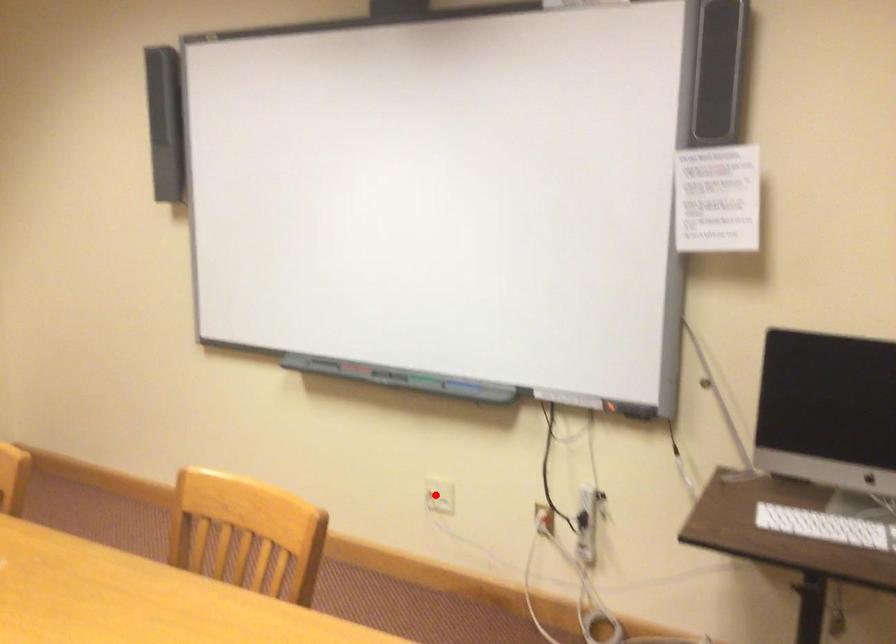
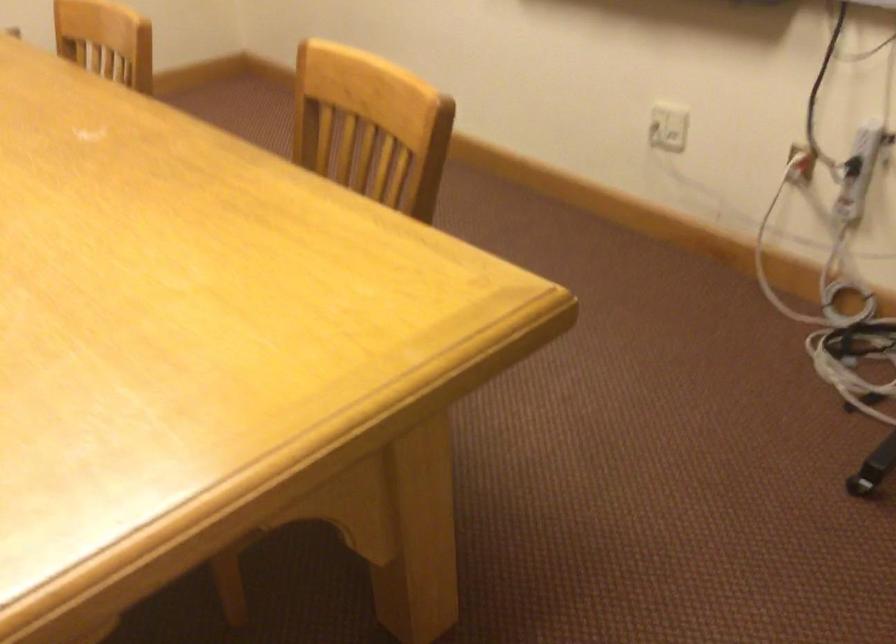
Question: I am providing you with two images of the same scene from different viewpoints. In image1, a red point is highlighted. Considering the same 3D point in image2, which of the following is correct?

Choices:
 (A) It is closer
 (B) It is farther

Answer: (A)